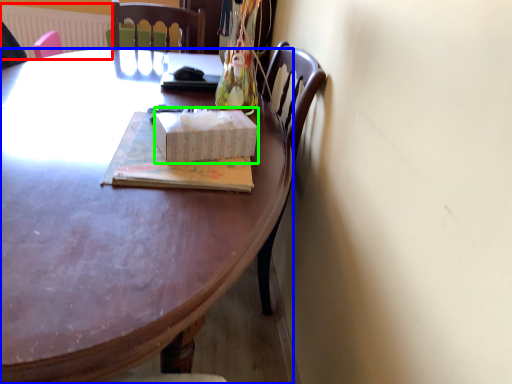
Question: Based on their relative distances, which object is farther from radiator (highlighted by a red box)? Choose from desk (highlighted by a blue box) and box (highlighted by a green box).

Choices:
 (A) desk
 (B) box

Answer: (B)